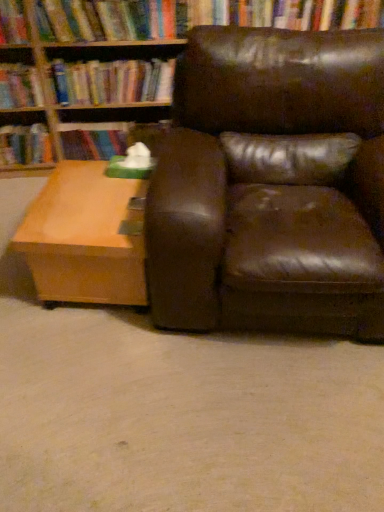
This screenshot has width=384, height=512. Find the location of `vacant space in front of brown leather chair at center`. vacant space in front of brown leather chair at center is located at coordinates (232, 421).